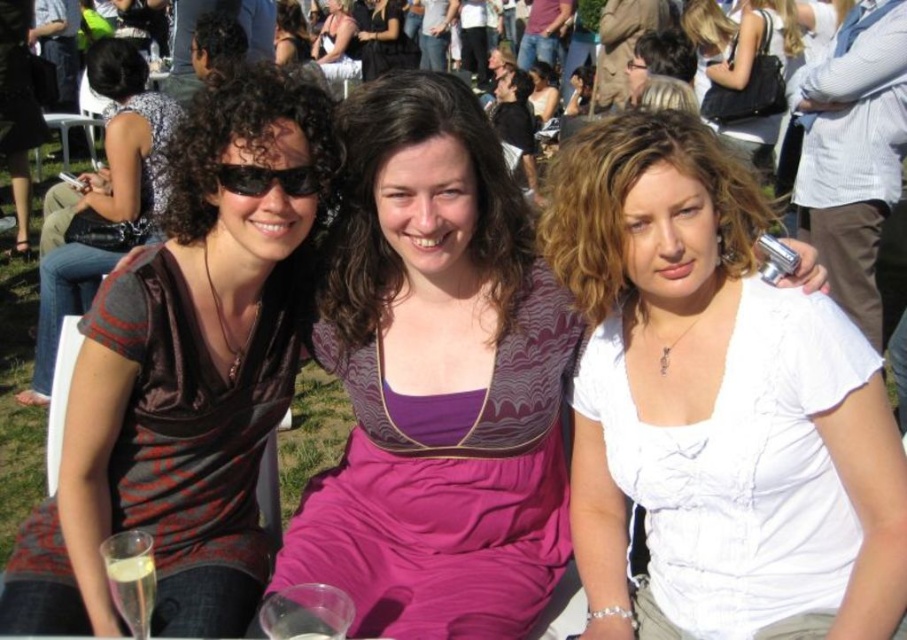
Between point (150, 115) and point (244, 179), which one is positioned behind?

The point (150, 115) is more distant.

Consider the image. Measure the distance between matte black dress at left and camera.

matte black dress at left is 2.27 meters from camera.

Locate an element on the screen. The height and width of the screenshot is (640, 907). matte black dress at left is located at coordinates (128, 140).

Who is more distant from viewer, (808,401) or (554,104)?

Positioned behind is point (554,104).

Looking at this image, is white matte shirt at center behind matte black hair at upper center?

No, white matte shirt at center is closer to the viewer.

Who is more distant from viewer, [758,301] or [556,77]?

Positioned behind is point [556,77].

This screenshot has width=907, height=640. I want to click on white matte shirt at center, so click(714, 396).

In the scene shown: Does purple satin dress at center have a greater width compared to matte black hair at upper center?

Yes.

Between purple satin dress at center and matte black hair at upper center, which one has less height?

With less height is matte black hair at upper center.

Who is more distant from viewer, (442, 275) or (551, 84)?

Point (551, 84)

The image size is (907, 640). Find the location of `purple satin dress at center`. purple satin dress at center is located at coordinates (436, 380).